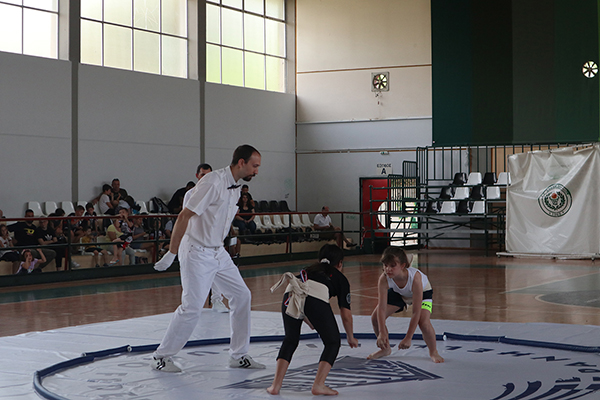
Locate an element on the screen. This screenshot has width=600, height=400. benches is located at coordinates (65, 262).